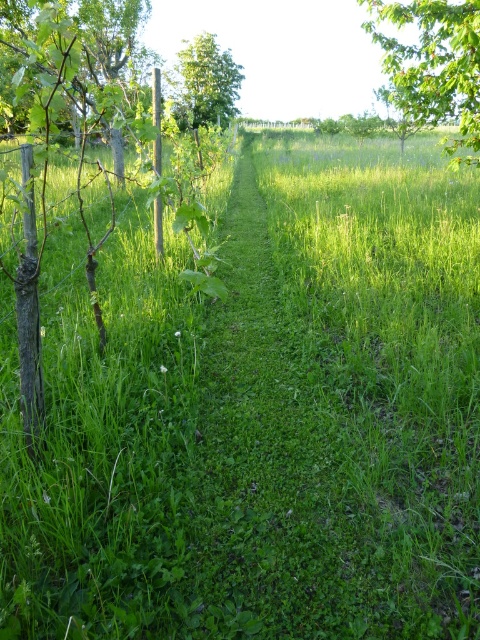
Question: Can you confirm if green leafy tree at left is bigger than green leafy tree at upper right?

Choices:
 (A) no
 (B) yes

Answer: (B)

Question: Which point is farther to the camera?

Choices:
 (A) green leafy tree at center
 (B) green leafy tree at left

Answer: (A)

Question: Which point is farther from the camera taking this photo?

Choices:
 (A) (471, 44)
 (B) (45, 211)

Answer: (A)

Question: Is green leafy tree at left to the left of green leafy tree at center from the viewer's perspective?

Choices:
 (A) no
 (B) yes

Answer: (B)

Question: Based on their relative distances, which object is farther from the green leafy tree at left?

Choices:
 (A) green leafy tree at upper right
 (B) green leafy tree at center

Answer: (B)

Question: Does green leafy tree at left appear on the left side of green leafy tree at upper right?

Choices:
 (A) no
 (B) yes

Answer: (B)